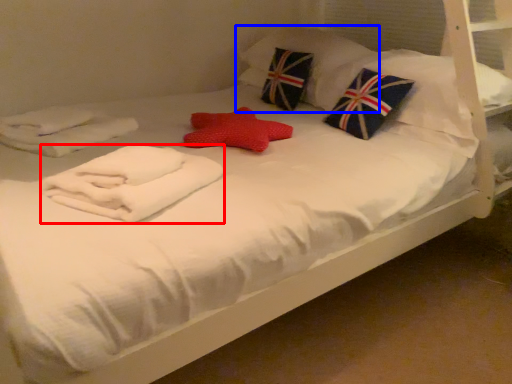
Question: Which object appears farthest to the camera in this image, material (highlighted by a red box) or pillow (highlighted by a blue box)?

Choices:
 (A) material
 (B) pillow

Answer: (B)